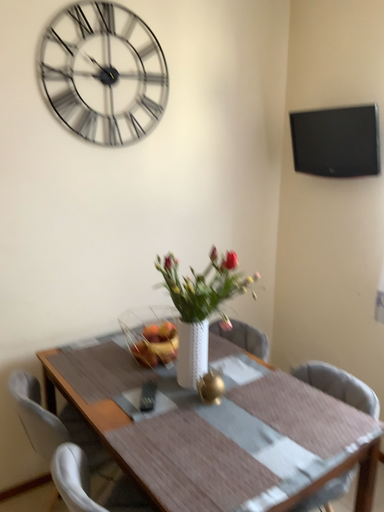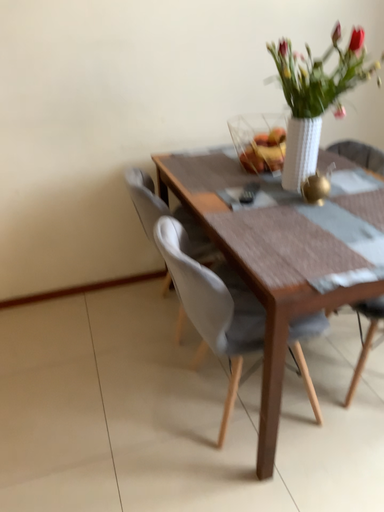
Question: Which way did the camera rotate in the video?

Choices:
 (A) rotated right
 (B) rotated left

Answer: (B)